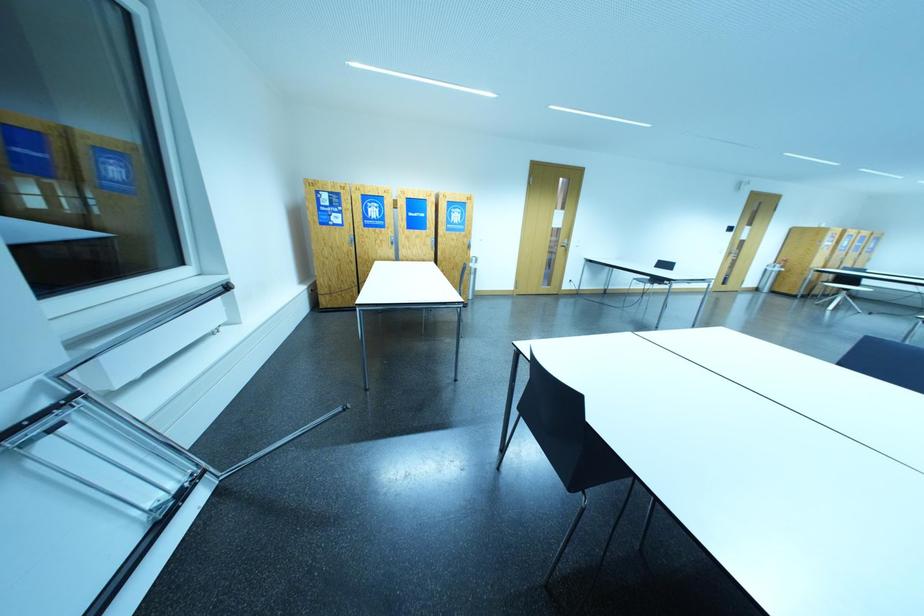
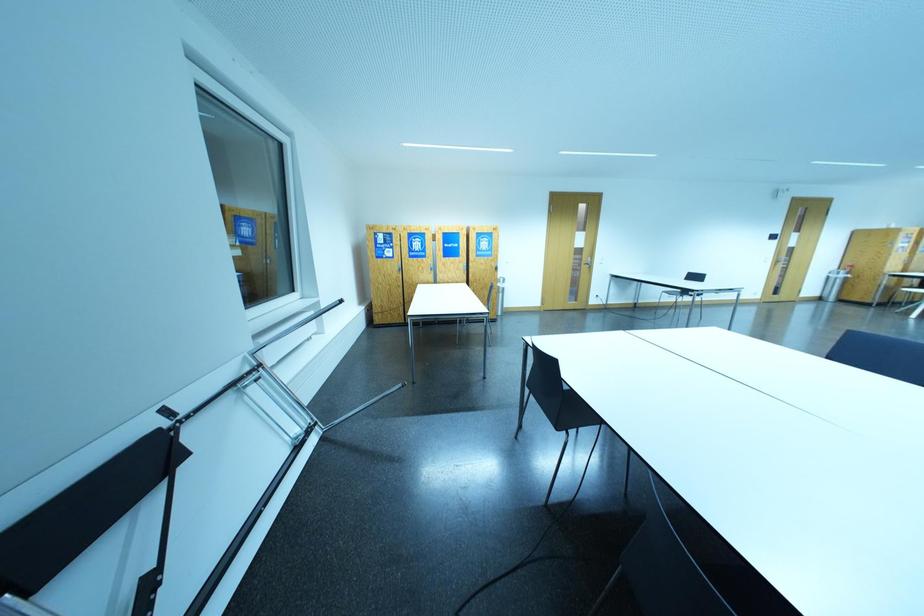
Question: Which direction would the cameraman need to move to produce the second image? Reply with the corresponding letter.

Choices:
 (A) Left
 (B) Right
 (C) Forward
 (D) Backward

Answer: (D)